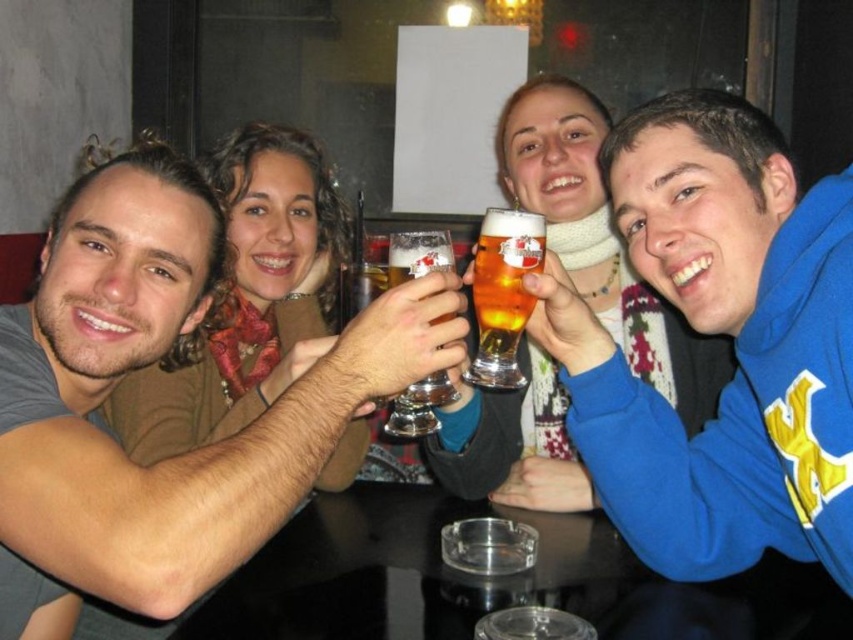
Can you confirm if blue fleece sweatshirt at upper right is positioned above translucent glass mug at center?

No, blue fleece sweatshirt at upper right is not above translucent glass mug at center.

Does blue fleece sweatshirt at upper right have a smaller size compared to translucent glass mug at center?

No.

Is point (619, 400) positioned behind point (495, 356)?

Yes, point (619, 400) is farther from viewer.

The width and height of the screenshot is (853, 640). I want to click on blue fleece sweatshirt at upper right, so click(720, 333).

Who is higher up, matte gray shirt at left or transparent glass ashtray at center?

matte gray shirt at left

Who is taller, matte gray shirt at left or transparent glass ashtray at center?

matte gray shirt at left

Is point (7, 536) closer to viewer compared to point (288, 616)?

Yes, it is in front of point (288, 616).

At what (x,y) coordinates should I click in order to perform the action: click on matte gray shirt at left. Please return your answer as a coordinate pair (x, y). The height and width of the screenshot is (640, 853). Looking at the image, I should click on (143, 365).

Which is in front, point (329, 413) or point (722, 403)?

Positioned in front is point (329, 413).

Does matte gray shirt at left have a lesser height compared to blue fleece sweatshirt at upper right?

No.

What do you see at coordinates (143, 365) in the screenshot?
I see `matte gray shirt at left` at bounding box center [143, 365].

The image size is (853, 640). Identify the location of matte gray shirt at left. (143, 365).